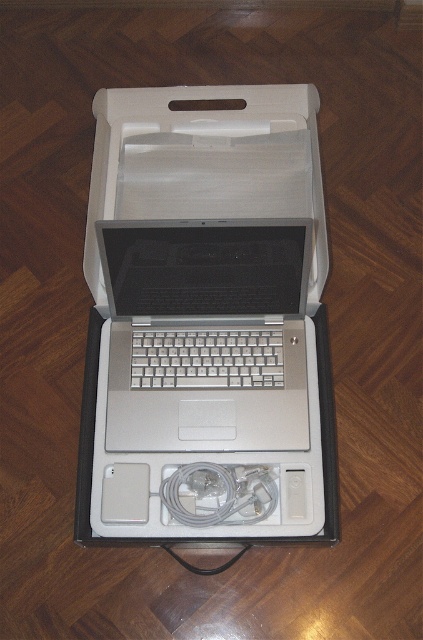
You are packing a laptop and its accessories into a carrying case. You have a white plastic box at center and a silver metallic laptop at center. Which item takes up more vertical space in the case?

The white plastic box at center is taller than the silver metallic laptop at center, so it takes up more vertical space in the case.